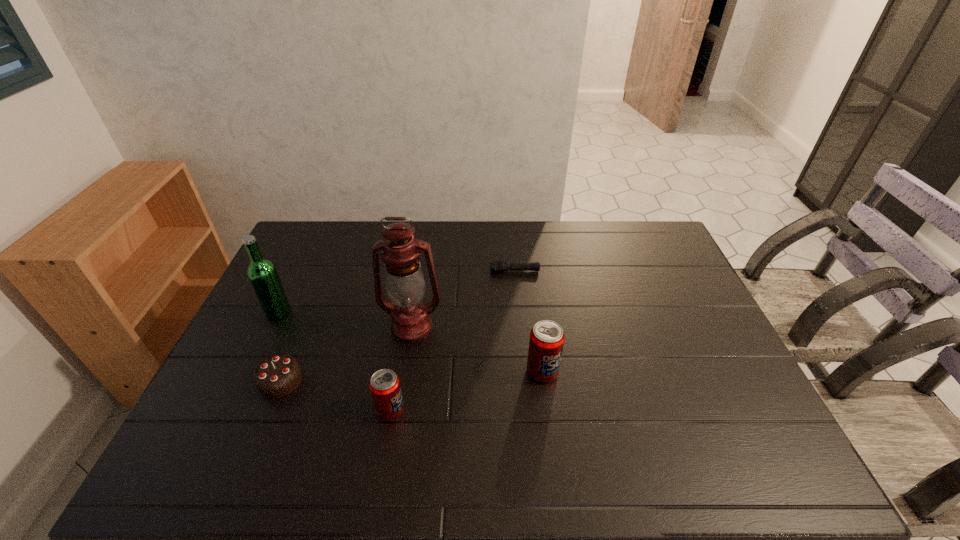
Please point a vacant point for placing a soda can on the right. Please provide its 2D coordinates. Your answer should be formatted as a tuple, i.e. [(x, y)], where the tuple contains the x and y coordinates of a point satisfying the conditions above.

[(673, 338)]